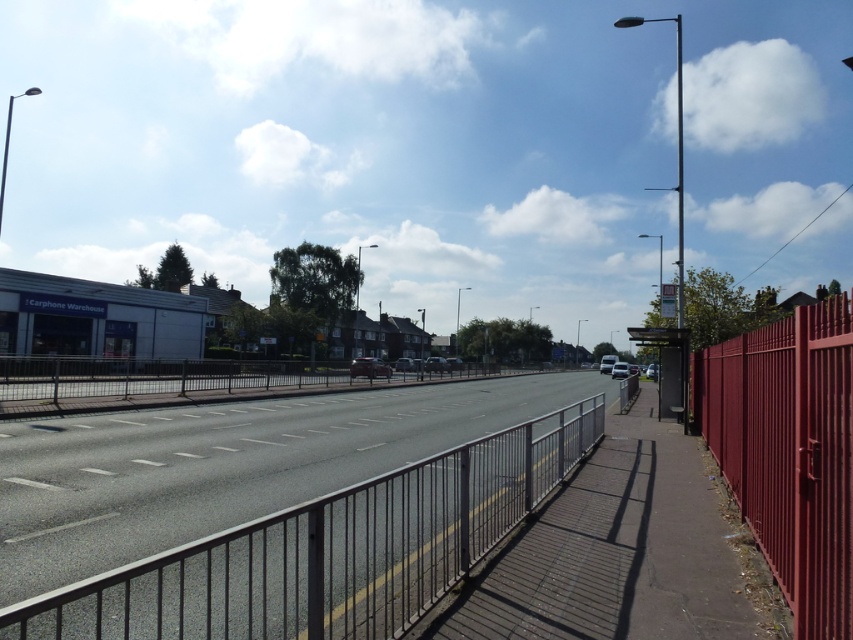
You are standing on the sidewalk and want to cross the road to reach the residential houses behind the Carphone Warehouse building. The road has multiple lanes. Which obstacle would you encounter first while crossing the road, the metallic silver rail at center or the smooth glossy red fence at right?

You would first encounter the metallic silver rail at center because it is closer to the viewer than the smooth glossy red fence at right, which is further away.

You are driving a car on the road and see two points marked on the road ahead. The first point is at coordinate point (308, 532) and the second is at point (846, 556). According to the image, which point is closer to your current position?

Point (308, 532) is behind point (846, 556), so the point closer to your current position is point (846, 556).

You are a delivery person carrying a large package that is 3 meters wide. You need to move from the road to the sidewalk but have to pass between the metallic silver rail at center and the smooth glossy red fence at right. Will your package fit through the space between them?

The metallic silver rail at center and smooth glossy red fence at right are 3.34 meters apart from each other. Since your package is 3 meters wide, it will fit through the space between them as 3 meters is less than 3.34 meters.